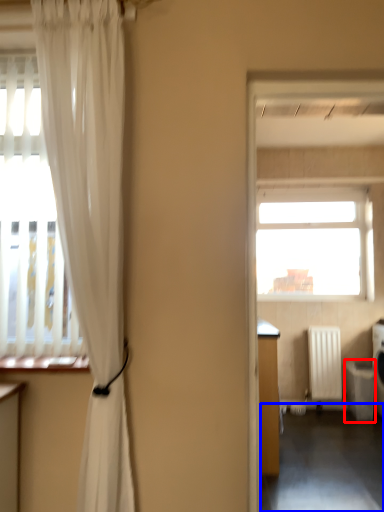
Question: Which object appears closest to the camera in this image, dish washer (highlighted by a red box) or corridor (highlighted by a blue box)?

Choices:
 (A) dish washer
 (B) corridor

Answer: (B)